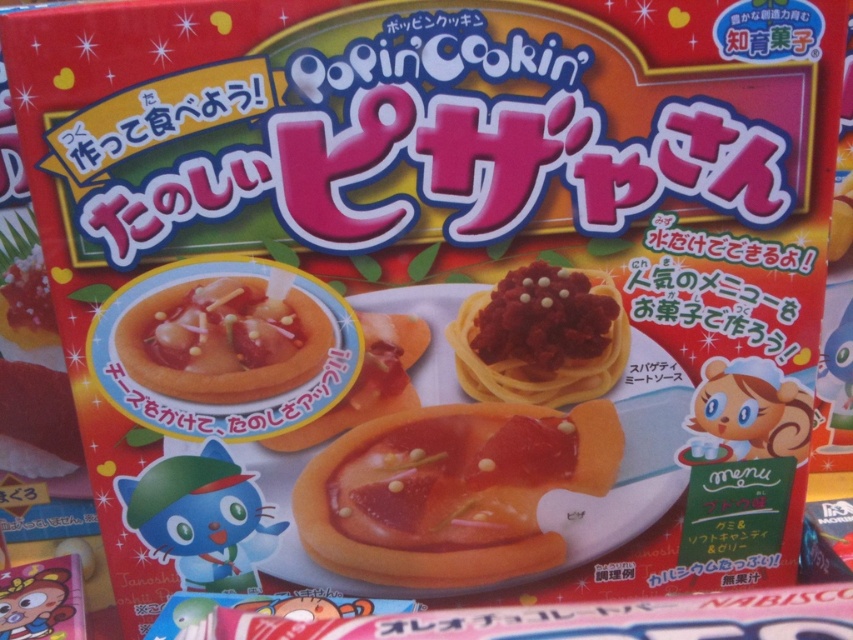
Can you confirm if matte plastic bowl at center-left is shorter than matte red pasta at center?

Correct, matte plastic bowl at center-left is not as tall as matte red pasta at center.

Does matte plastic bowl at center-left lie behind matte red pasta at center?

No, it is not.

Is point (244, 288) in front of point (608, 288)?

Yes, it is in front of point (608, 288).

This screenshot has width=853, height=640. Find the location of `matte plastic bowl at center-left`. matte plastic bowl at center-left is located at coordinates (223, 340).

Does orange soft candy at center lie behind matte plastic bowl at center-left?

Yes, it is.

Locate an element on the screen. The width and height of the screenshot is (853, 640). orange soft candy at center is located at coordinates (451, 492).

Is point (407, 536) more distant than point (225, 364)?

Yes.

Locate an element on the screen. orange soft candy at center is located at coordinates (451, 492).

Who is more forward, (x=398, y=442) or (x=561, y=326)?

Point (x=561, y=326) is more forward.

Who is positioned more to the right, orange soft candy at center or matte red pasta at center?

Positioned to the right is matte red pasta at center.

Is point (498, 440) positioned before point (508, 365)?

No, (498, 440) is behind (508, 365).

At what (x,y) coordinates should I click in order to perform the action: click on orange soft candy at center. Please return your answer as a coordinate pair (x, y). The width and height of the screenshot is (853, 640). Looking at the image, I should click on (451, 492).